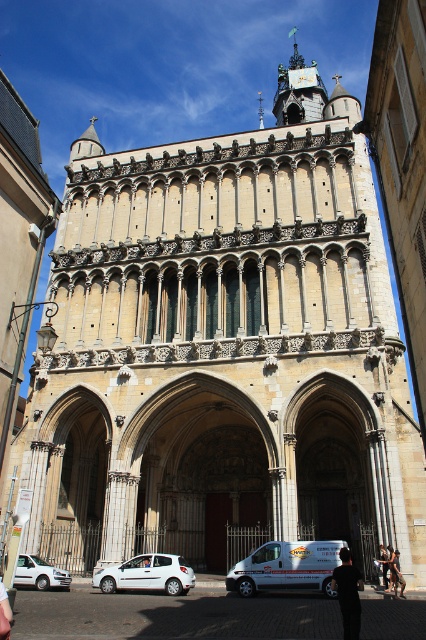
Does point (186, 564) come closer to viewer compared to point (29, 554)?

No, (186, 564) is further to viewer.

Who is taller, white matte hatchback at lower left or white matte van at lower left?

With more height is white matte hatchback at lower left.

Is point (132, 570) positioned after point (23, 573)?

That is False.

I want to click on white matte hatchback at lower left, so click(x=147, y=573).

Which is more to the right, white matte van at lower left or white fabric person at center?

white fabric person at center is more to the right.

Who is positioned more to the left, white matte van at lower left or white fabric person at center?

Positioned to the left is white matte van at lower left.

Identify the location of white matte van at lower left. The width and height of the screenshot is (426, 640). (40, 573).

Is dark gray fabric pants at center positioned in front of brown leather jacket at lower center?

Yes, it is in front of brown leather jacket at lower center.

Does dark gray fabric pants at center appear on the left side of brown leather jacket at lower center?

Incorrect, dark gray fabric pants at center is not on the left side of brown leather jacket at lower center.

Where is `dark gray fabric pants at center`? The height and width of the screenshot is (640, 426). dark gray fabric pants at center is located at coordinates (396, 572).

Where is `dark gray fabric pants at center`? dark gray fabric pants at center is located at coordinates (396, 572).